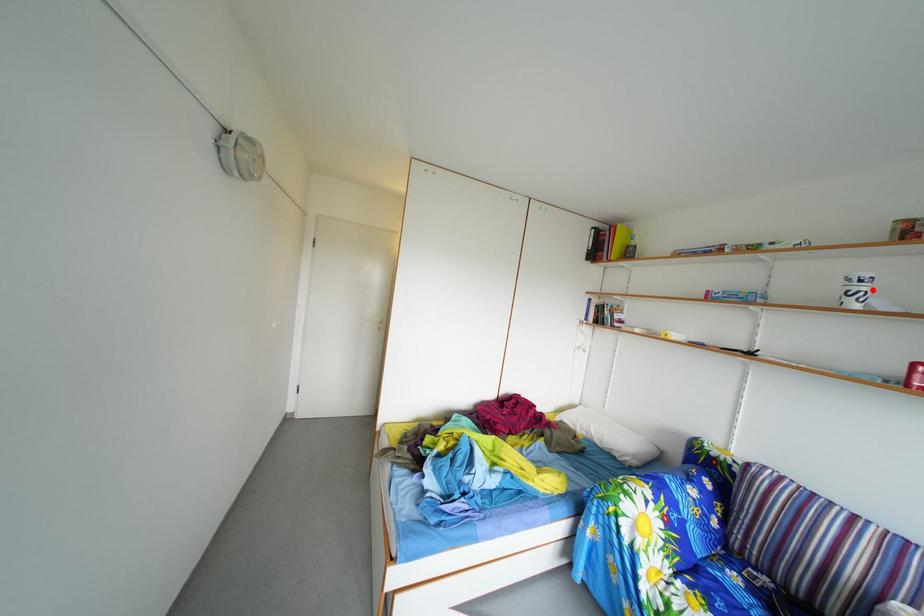
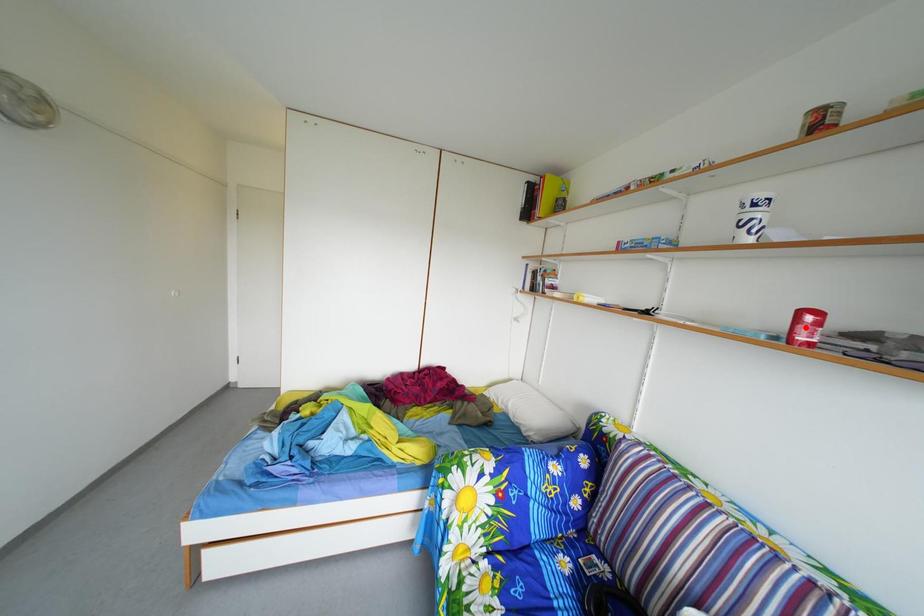
I am providing you with two images of the same scene from different viewpoints. A red point is marked on the first image and another point is marked on the second image. Is the red point in image1 aligned with the point shown in image2?

No